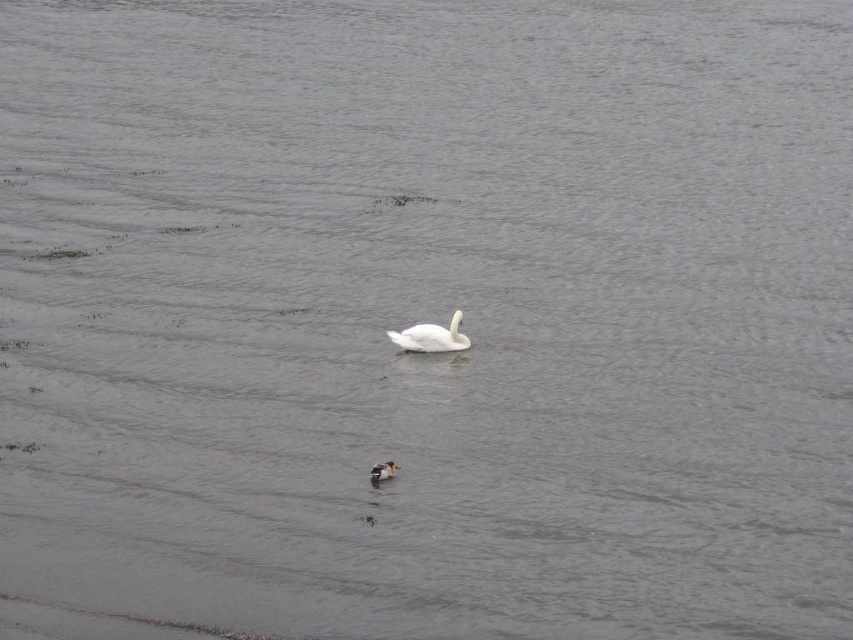
Question: Is white smooth swan at center bigger than brown speckled duck at center?

Choices:
 (A) no
 (B) yes

Answer: (B)

Question: Does white smooth swan at center have a smaller size compared to brown speckled duck at center?

Choices:
 (A) yes
 (B) no

Answer: (B)

Question: Which of the following is the farthest from the observer?

Choices:
 (A) (426, 330)
 (B) (381, 468)

Answer: (A)

Question: From the image, what is the correct spatial relationship of white smooth swan at center in relation to brown speckled duck at center?

Choices:
 (A) left
 (B) right

Answer: (B)

Question: Which of the following is the closest to the observer?

Choices:
 (A) click(x=386, y=468)
 (B) click(x=405, y=332)

Answer: (A)

Question: Among these objects, which one is farthest from the camera?

Choices:
 (A) brown speckled duck at center
 (B) white smooth swan at center

Answer: (B)